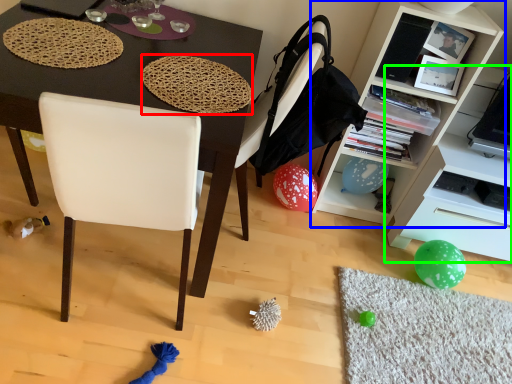
Question: Which object is the closest to the mat (highlighted by a red box)? Choose among these: cabinetry (highlighted by a blue box) or shelf (highlighted by a green box).

Choices:
 (A) cabinetry
 (B) shelf

Answer: (A)